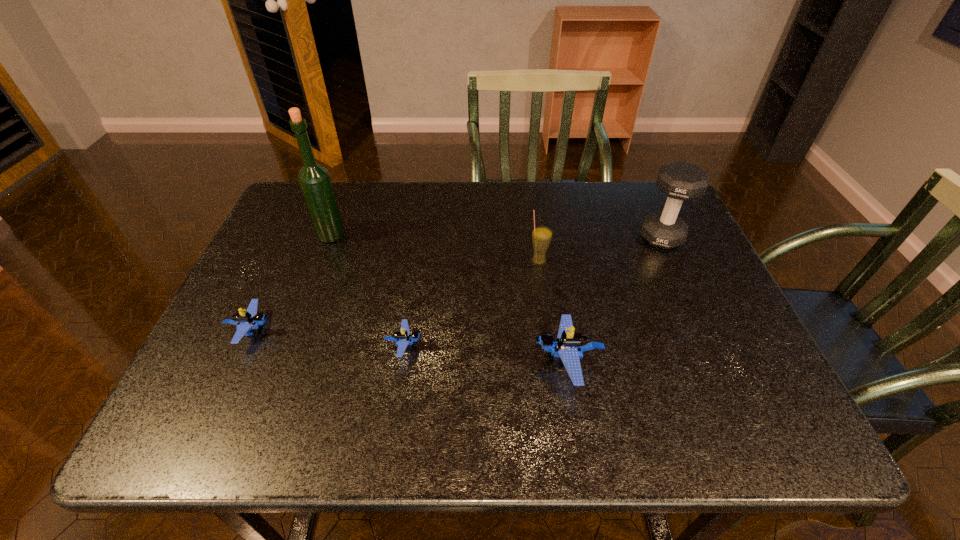
The image size is (960, 540). Find the location of `liquor`. liquor is located at coordinates (314, 180).

This screenshot has height=540, width=960. I want to click on the tallest object, so click(314, 180).

Locate an element on the screen. vacant space located 0.060m on the front-facing side of the second tallest Lego is located at coordinates (301, 330).

The width and height of the screenshot is (960, 540). I want to click on free space located on the front-facing side of the third object from left to right, so click(542, 346).

Find the location of a particular element. Image resolution: width=960 pixels, height=540 pixels. vacant space located on the front-facing side of the tallest Lego is located at coordinates (359, 362).

The image size is (960, 540). I want to click on free space located on the front-facing side of the tallest Lego, so click(x=401, y=362).

What are the coordinates of `free location located 0.340m on the front-facing side of the tallest Lego` in the screenshot? It's located at (372, 362).

Find the location of `vacant area located on the left of the rightmost object`. vacant area located on the left of the rightmost object is located at coordinates (599, 237).

Where is `free space located 0.310m on the right of the third farthest object`? free space located 0.310m on the right of the third farthest object is located at coordinates (667, 261).

Locate an element on the screen. The width and height of the screenshot is (960, 540). free space located 0.370m on the front of the fifth object from right to left is located at coordinates (286, 357).